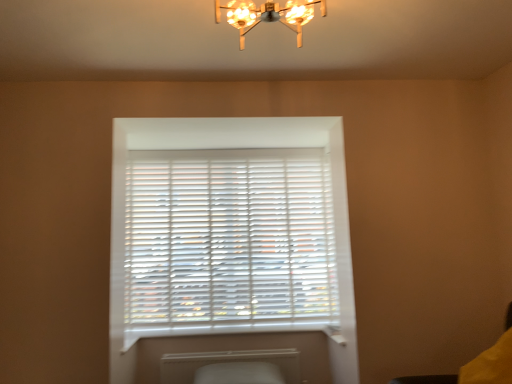
Question: Is white matte radiator at lower center wider or thinner than metallic chandelier at upper center?

Choices:
 (A) wide
 (B) thin

Answer: (B)

Question: In terms of height, does white matte radiator at lower center look taller or shorter compared to metallic chandelier at upper center?

Choices:
 (A) tall
 (B) short

Answer: (A)

Question: Considering the real-world distances, which object is farthest from the white plastic window sill at lower center?

Choices:
 (A) white matte radiator at lower center
 (B) metallic chandelier at upper center
 (C) white matte blinds at center
 (D) yellow fabric swivel chair at lower right

Answer: (B)

Question: Estimate the real-world distances between objects in this image. Which object is farther from the metallic chandelier at upper center?

Choices:
 (A) white plastic window sill at lower center
 (B) yellow fabric swivel chair at lower right
 (C) white matte radiator at lower center
 (D) white matte blinds at center

Answer: (C)